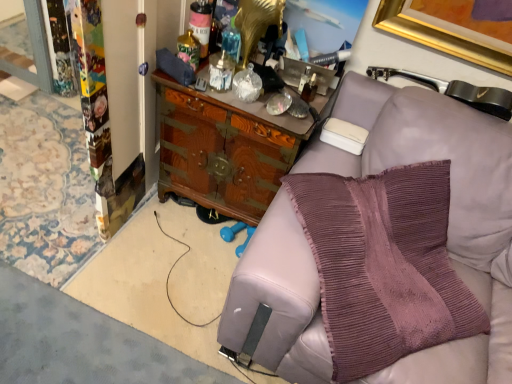
Locate an element on the screen. wooden cabinet at center is located at coordinates (226, 148).

Describe the element at coordinates (226, 148) in the screenshot. This screenshot has width=512, height=384. I see `wooden cabinet at center` at that location.

Looking at this image, measure the distance between wooden cabinet at center and camera.

wooden cabinet at center is 1.51 meters from camera.

What do you see at coordinates (384, 265) in the screenshot?
I see `purple knitted pillow at right` at bounding box center [384, 265].

Where is `purple knitted pillow at right`? Image resolution: width=512 pixels, height=384 pixels. purple knitted pillow at right is located at coordinates (384, 265).

Find the location of a particular element. wooden cabinet at center is located at coordinates (226, 148).

Can you confirm if purple knitted pillow at right is positioned to the right of wooden cabinet at center?

Indeed, purple knitted pillow at right is positioned on the right side of wooden cabinet at center.

Is purple knitted pillow at right positioned in front of wooden cabinet at center?

Yes, it is in front of wooden cabinet at center.

Is point (464, 329) closer or farther from the camera than point (238, 189)?

Point (464, 329) appears to be closer to the viewer than point (238, 189).

From the image's perspective, which is above, purple knitted pillow at right or wooden cabinet at center?

wooden cabinet at center is shown above in the image.

From a real-world perspective, is purple knitted pillow at right beneath wooden cabinet at center?

No, from a real-world perspective, purple knitted pillow at right is not below wooden cabinet at center.

Considering the sizes of objects purple knitted pillow at right and wooden cabinet at center in the image provided, who is thinner, purple knitted pillow at right or wooden cabinet at center?

With smaller width is purple knitted pillow at right.

Which of these two, purple knitted pillow at right or wooden cabinet at center, stands shorter?

With less height is wooden cabinet at center.

Which of these two, purple knitted pillow at right or wooden cabinet at center, is smaller?

Smaller between the two is wooden cabinet at center.

Is purple knitted pillow at right situated inside wooden cabinet at center or outside?

purple knitted pillow at right is not enclosed by wooden cabinet at center.

Does purple knitted pillow at right touch wooden cabinet at center?

No, purple knitted pillow at right is not in contact with wooden cabinet at center.

Does purple knitted pillow at right turn towards wooden cabinet at center?

No.

How many degrees apart are the facing directions of purple knitted pillow at right and wooden cabinet at center?

44.9 degrees.

Find the location of a particular element. pillow below the wooden cabinet at center (from the image's perspective) is located at coordinates (384, 265).

Based on the photo, between wooden cabinet at center and purple knitted pillow at right, which one appears on the left side from the viewer's perspective?

From the viewer's perspective, wooden cabinet at center appears more on the left side.

Which object is further away from the camera taking this photo, wooden cabinet at center or purple knitted pillow at right?

wooden cabinet at center.

Considering the points (238, 156) and (412, 168), which point is behind, point (238, 156) or point (412, 168)?

Positioned behind is point (238, 156).

From the image's perspective, is wooden cabinet at center on purple knitted pillow at right?

Yes, from the image's perspective, wooden cabinet at center is above purple knitted pillow at right.

From a real-world perspective, which is physically above, wooden cabinet at center or purple knitted pillow at right?

purple knitted pillow at right is physically above.

Considering the sizes of wooden cabinet at center and purple knitted pillow at right in the image, is wooden cabinet at center wider or thinner than purple knitted pillow at right?

In the image, wooden cabinet at center appears to be wider than purple knitted pillow at right.

Is wooden cabinet at center shorter than purple knitted pillow at right?

Indeed, wooden cabinet at center has a lesser height compared to purple knitted pillow at right.

Is wooden cabinet at center bigger than purple knitted pillow at right?

Actually, wooden cabinet at center might be smaller than purple knitted pillow at right.

Looking at this image, choose the correct answer: Is wooden cabinet at center inside purple knitted pillow at right or outside it?

wooden cabinet at center exists outside the volume of purple knitted pillow at right.

Is wooden cabinet at center far away from purple knitted pillow at right?

No.

Is wooden cabinet at center oriented towards purple knitted pillow at right?

No, wooden cabinet at center is not turned towards purple knitted pillow at right.

Identify the location of cabinetry to the left of purple knitted pillow at right. (226, 148).

Where is `pillow that appears in front of the wooden cabinet at center`? pillow that appears in front of the wooden cabinet at center is located at coordinates (384, 265).

The image size is (512, 384). What are the coordinates of `pillow on the right of wooden cabinet at center` in the screenshot? It's located at (384, 265).